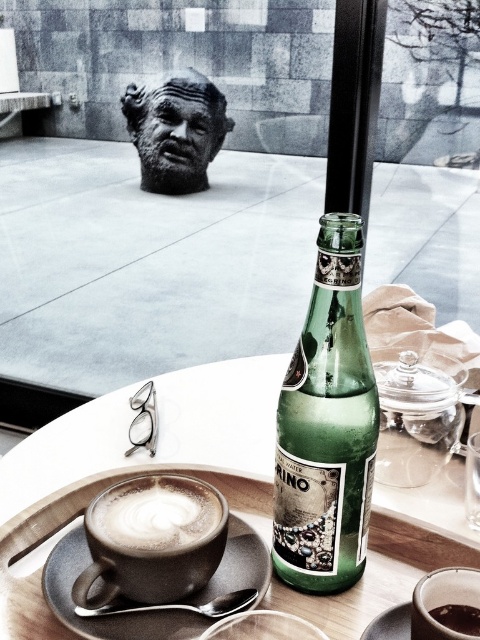
Which is in front, point (144, 99) or point (116, 528)?

Point (116, 528) is more forward.

This screenshot has width=480, height=640. Identify the location of black stone bust at upper center. (176, 129).

The width and height of the screenshot is (480, 640). In order to click on black stone bust at upper center in this screenshot , I will do `click(176, 129)`.

The image size is (480, 640). In order to click on black stone bust at upper center in this screenshot , I will do `click(176, 129)`.

Between matte white tray at center and matte ceramic saucer at lower left, which one appears on the left side from the viewer's perspective?

matte ceramic saucer at lower left is more to the left.

Identify the location of matte white tray at center. This screenshot has width=480, height=640. (159, 440).

Locate an element on the screen. Image resolution: width=480 pixels, height=640 pixels. matte white tray at center is located at coordinates (159, 440).

Is matte white tray at center wider than matte ceramic mug at lower center?

Yes.

In the scene shown: Can you confirm if matte white tray at center is taller than matte ceramic mug at lower center?

Correct, matte white tray at center is much taller as matte ceramic mug at lower center.

What are the coordinates of `matte white tray at center` in the screenshot? It's located at (159, 440).

The width and height of the screenshot is (480, 640). Identify the location of matte white tray at center. (159, 440).